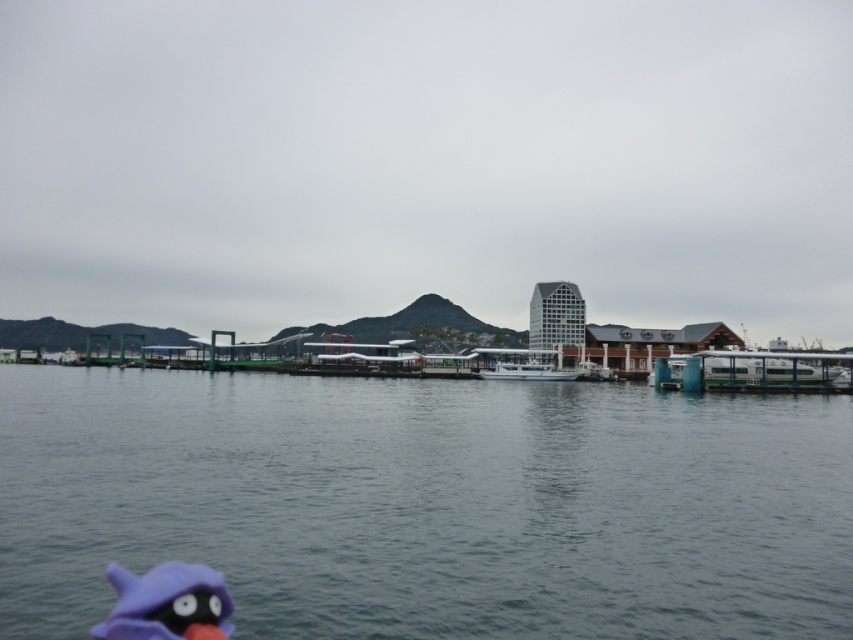
Who is more forward, (312, 500) or (717, 355)?

Point (312, 500) is more forward.

Is gray water at center wider than white glossy boat at right?

Yes, gray water at center is wider than white glossy boat at right.

Between point (724, 586) and point (819, 384), which one is positioned behind?

The point (819, 384) is behind.

Where is `gray water at center`? The height and width of the screenshot is (640, 853). gray water at center is located at coordinates (427, 504).

Can you confirm if purple fabric toy at lower left is taller than white glossy boat at right?

Incorrect, purple fabric toy at lower left's height is not larger of white glossy boat at right's.

Which is more to the right, purple fabric toy at lower left or white glossy boat at right?

white glossy boat at right

Locate an element on the screen. purple fabric toy at lower left is located at coordinates (167, 604).

Which is more to the right, purple fabric toy at lower left or white glossy boat at center?

From the viewer's perspective, white glossy boat at center appears more on the right side.

Describe the element at coordinates (167, 604) in the screenshot. I see `purple fabric toy at lower left` at that location.

Does point (117, 573) come closer to viewer compared to point (527, 356)?

Yes, it is.

You are a GUI agent. You are given a task and a screenshot of the screen. Output one action in this format:
    pyautogui.click(x=<x>, y=<y>)
    Task: Click on the purple fabric toy at lower left
    The height and width of the screenshot is (640, 853).
    Given the screenshot: What is the action you would take?
    pyautogui.click(x=167, y=604)